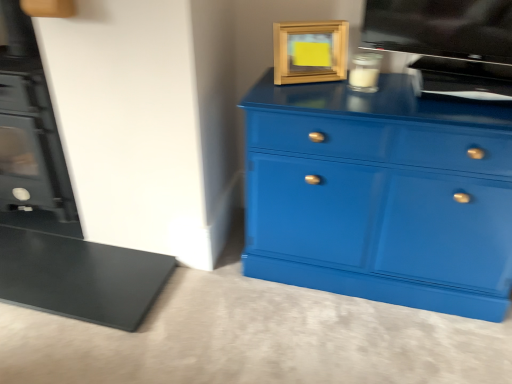
Find the location of `vacant space positioned to the left of clear glass candle at upper center, which appears as the second appliance when viewed from the right`. vacant space positioned to the left of clear glass candle at upper center, which appears as the second appliance when viewed from the right is located at coordinates (323, 91).